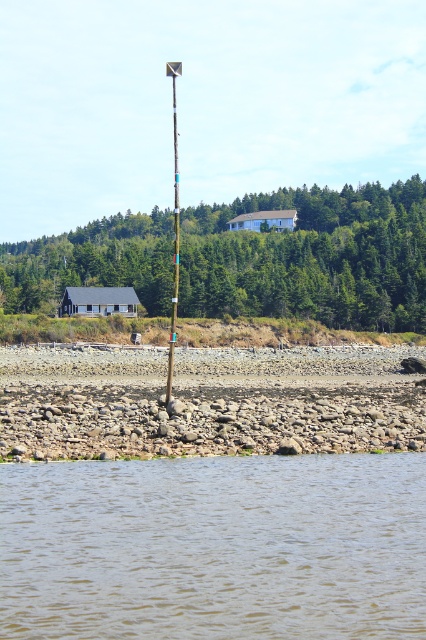
Question: Is green textured tree at upper center positioned in front of metallic silver pole at center?

Choices:
 (A) yes
 (B) no

Answer: (B)

Question: Which of the following is the closest to the observer?

Choices:
 (A) brown water at lower center
 (B) metallic silver pole at center
 (C) green textured tree at upper center

Answer: (A)

Question: From the image, what is the correct spatial relationship of brown water at lower center in relation to metallic silver pole at center?

Choices:
 (A) left
 (B) right

Answer: (B)

Question: Is green textured tree at upper center behind metallic silver pole at center?

Choices:
 (A) no
 (B) yes

Answer: (B)

Question: Which point is closer to the camera?

Choices:
 (A) green textured tree at upper center
 (B) brown water at lower center
 (C) metallic silver pole at center

Answer: (B)

Question: Based on their relative distances, which object is nearer to the green textured tree at upper center?

Choices:
 (A) brown water at lower center
 (B) metallic silver pole at center

Answer: (B)